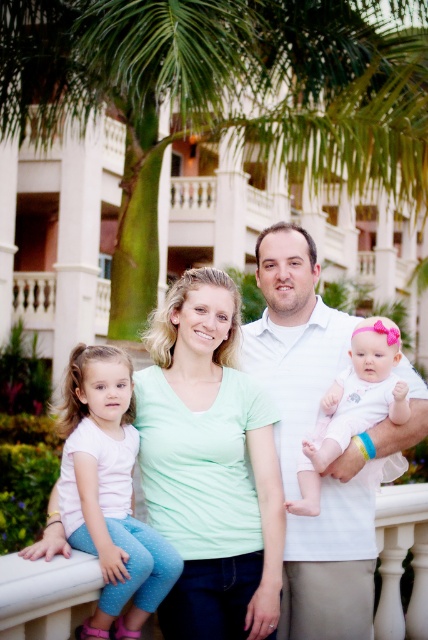
Question: Which object is farther from the camera taking this photo?

Choices:
 (A) pink fabric baby at center
 (B) white cotton shirt at center
 (C) white soft fabric baby at center

Answer: (B)

Question: Considering the relative positions of white cotton shirt at center and white soft fabric baby at center in the image provided, where is white cotton shirt at center located with respect to white soft fabric baby at center?

Choices:
 (A) right
 (B) left

Answer: (B)

Question: Does pink fabric shirt at left have a smaller size compared to white soft fabric baby at center?

Choices:
 (A) yes
 (B) no

Answer: (A)

Question: Which of these objects is positioned closest to the white cotton shirt at center?

Choices:
 (A) pink fabric shirt at left
 (B) white soft fabric baby at center

Answer: (B)

Question: In this image, where is pink fabric shirt at left located relative to white soft fabric baby at center?

Choices:
 (A) above
 (B) below

Answer: (B)

Question: Which of the following is the farthest from the observer?

Choices:
 (A) white soft fabric baby at center
 (B) pink fabric shirt at left
 (C) pink fabric baby at center
 (D) white cotton shirt at center

Answer: (D)